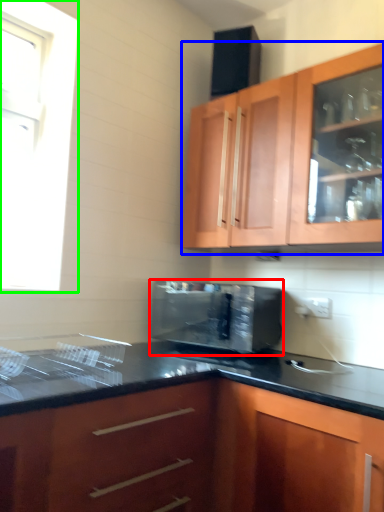
Question: Based on their relative distances, which object is nearer to microwave oven (highlighted by a red box)? Choose from cabinetry (highlighted by a blue box) and window (highlighted by a green box).

Choices:
 (A) cabinetry
 (B) window

Answer: (A)